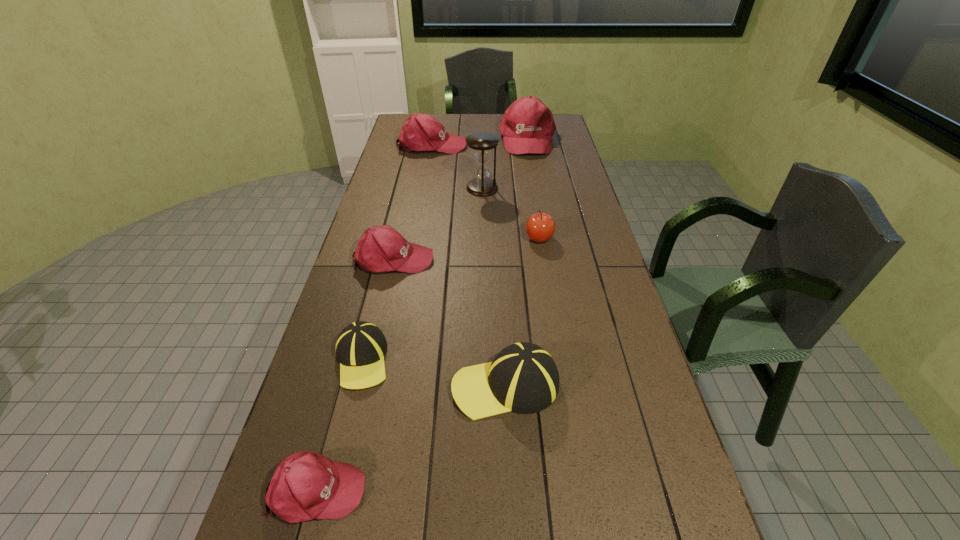
Locate an element on the screen. the nearest baseball cap is located at coordinates (306, 485).

The height and width of the screenshot is (540, 960). Find the location of `the smaller black baseball cap`. the smaller black baseball cap is located at coordinates (360, 347).

I want to click on vacant space located on the back of the hourglass, so click(x=482, y=153).

The width and height of the screenshot is (960, 540). Identify the location of free space located 0.120m at the front of the seventh shortest object with the brim. (534, 172).

I want to click on free spot located at the front of the second biggest red baseball cap with the brim, so click(x=542, y=145).

Identify the location of vacant point located 0.370m at the front of the second nearest red baseball cap with the brim. This screenshot has width=960, height=540. (547, 259).

Where is `free space located 0.380m on the front of the apple`? The image size is (960, 540). free space located 0.380m on the front of the apple is located at coordinates (555, 333).

You are a GUI agent. You are given a task and a screenshot of the screen. Output one action in this format:
    pyautogui.click(x=<x>, y=<y>)
    Task: Click on the vacant area situated 0.160m with the brim of the bigger black baseball cap facing forward
    The image size is (960, 540).
    Given the screenshot: What is the action you would take?
    pyautogui.click(x=387, y=385)

You are a GUI agent. You are given a task and a screenshot of the screen. Output one action in this format:
    pyautogui.click(x=<x>, y=<y>)
    Task: Click on the free region located 0.110m with the brim of the bigger black baseball cap facing forward
    Image resolution: width=960 pixels, height=540 pixels.
    Given the screenshot: What is the action you would take?
    pyautogui.click(x=407, y=385)

Locate an element on the screen. The width and height of the screenshot is (960, 540). free region located 0.330m with the brim of the bigger black baseball cap facing forward is located at coordinates (318, 385).